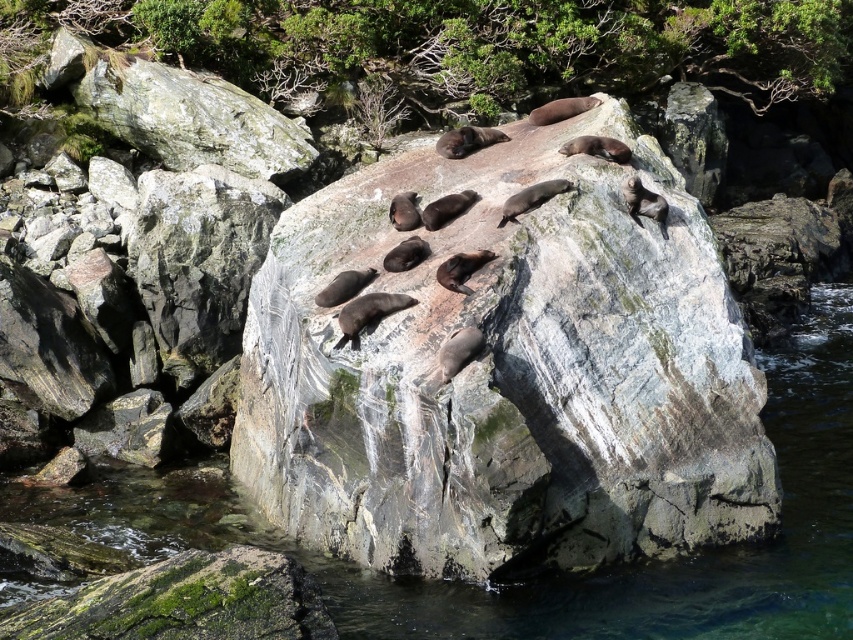
Can you confirm if smooth gray rock at center is smaller than clear water at rock center?

Yes, smooth gray rock at center is smaller than clear water at rock center.

Does smooth gray rock at center appear over clear water at rock center?

Indeed, smooth gray rock at center is positioned over clear water at rock center.

At what (x,y) coordinates should I click in order to perform the action: click on smooth gray rock at center. Please return your answer as a coordinate pair (x, y). This screenshot has width=853, height=640. Looking at the image, I should click on (x=508, y=374).